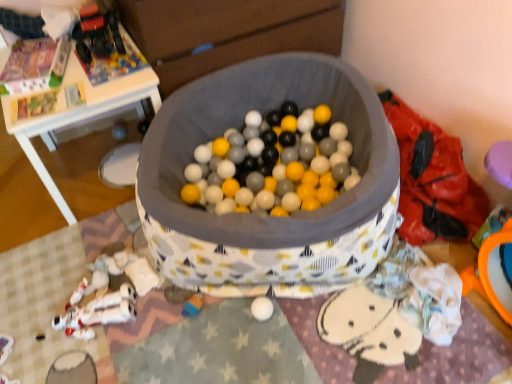
Question: From a real-world perspective, is rubberized plastic toy at lower center, positioned as the 1th toy in bottom-to-top order, positioned above or below white plastic toy at lower left, placed as the third toy when sorted from top to bottom?

Choices:
 (A) below
 (B) above

Answer: (A)

Question: Is point (199, 294) positioned closer to the camera than point (123, 307)?

Choices:
 (A) closer
 (B) farther

Answer: (B)

Question: Which object is positioned closest to the rubberized plastic toy at lower center, the fourth toy viewed from the top?

Choices:
 (A) white plastic toy at lower left, the 2th toy ordered from the bottom
 (B) metallic plastic toy truck at upper left, which appears as the fourth toy when ordered from the bottom
 (C) white plastic table at upper left
 (D) white matte plastic toy at lower left, placed as the second toy when sorted from top to bottom

Answer: (D)

Question: Estimate the real-world distances between objects in this image. Which object is closer to the white plastic table at upper left?

Choices:
 (A) rubberized plastic toy at lower center, positioned as the 1th toy in bottom-to-top order
 (B) metallic plastic toy truck at upper left, arranged as the first toy when viewed from the top
 (C) white matte plastic toy at lower left, placed as the second toy when sorted from top to bottom
 (D) white plastic toy at lower left, placed as the third toy when sorted from top to bottom

Answer: (B)